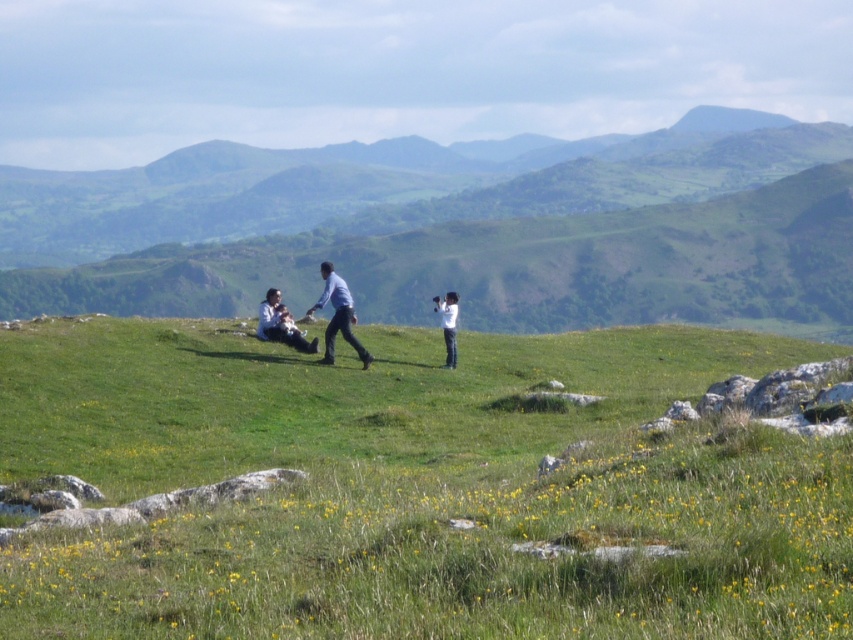
Who is taller, light blue fabric at center or white matte camera at center?

Standing taller between the two is white matte camera at center.

Is light blue fabric at center positioned in front of white matte camera at center?

Yes, it is in front of white matte camera at center.

Which is in front, point (264, 300) or point (454, 332)?

Positioned in front is point (264, 300).

Find the location of a particular element. This screenshot has height=640, width=853. light blue fabric at center is located at coordinates (281, 324).

Looking at this image, which of these two, matte blue shirt at center or white matte camera at center, stands taller?

Standing taller between the two is matte blue shirt at center.

Who is more distant from viewer, (367, 364) or (448, 320)?

The point (448, 320) is more distant.

The width and height of the screenshot is (853, 640). Identify the location of matte blue shirt at center. tap(337, 316).

The width and height of the screenshot is (853, 640). Describe the element at coordinates (416, 488) in the screenshot. I see `green grassy field at center` at that location.

Does green grassy field at center have a smaller size compared to white matte camera at center?

No.

Who is more distant from viewer, (48,417) or (450,356)?

Point (450,356)

Where is `green grassy field at center`? The image size is (853, 640). green grassy field at center is located at coordinates pos(416,488).